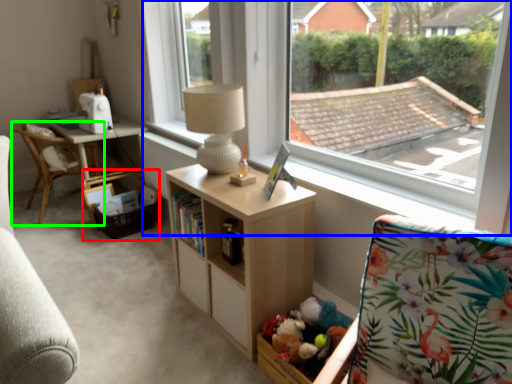
Question: Which object is positioned closest to picnic basket (highlighted by a red box)? Select from window (highlighted by a blue box) and chair (highlighted by a green box).

Choices:
 (A) window
 (B) chair

Answer: (B)